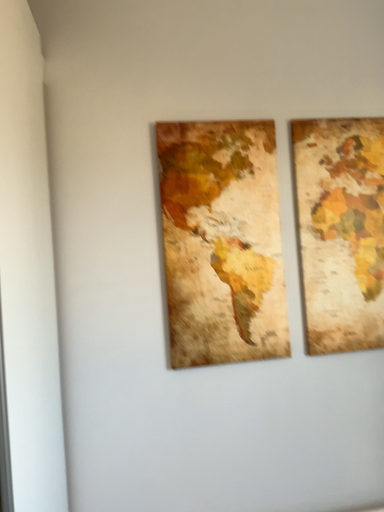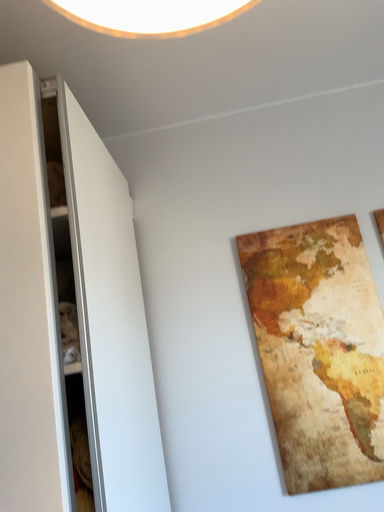
Question: Which way did the camera rotate in the video?

Choices:
 (A) rotated right
 (B) rotated left

Answer: (B)